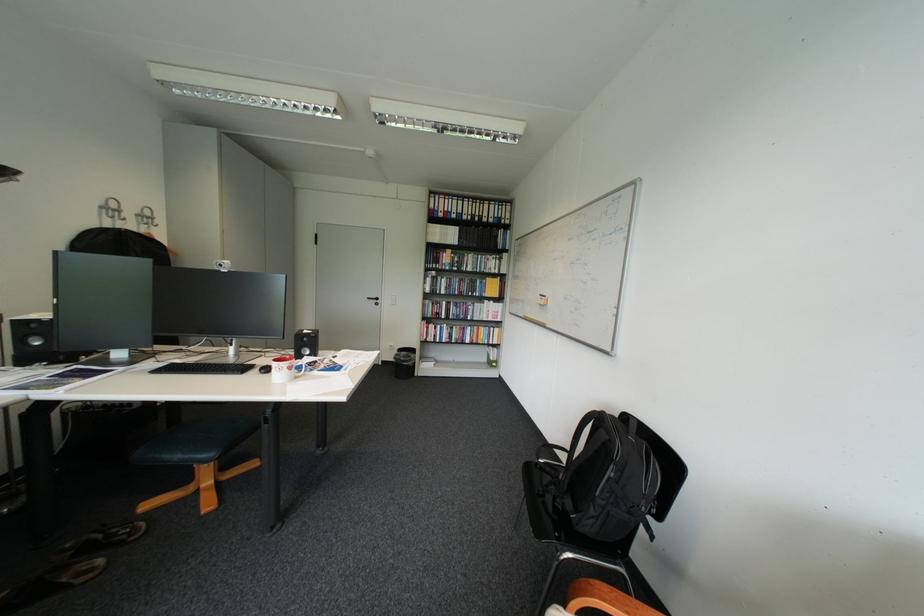
Where would you sit the dark chair sitting surface? Please return your answer as a coordinate pair (x, y).

(187, 444)